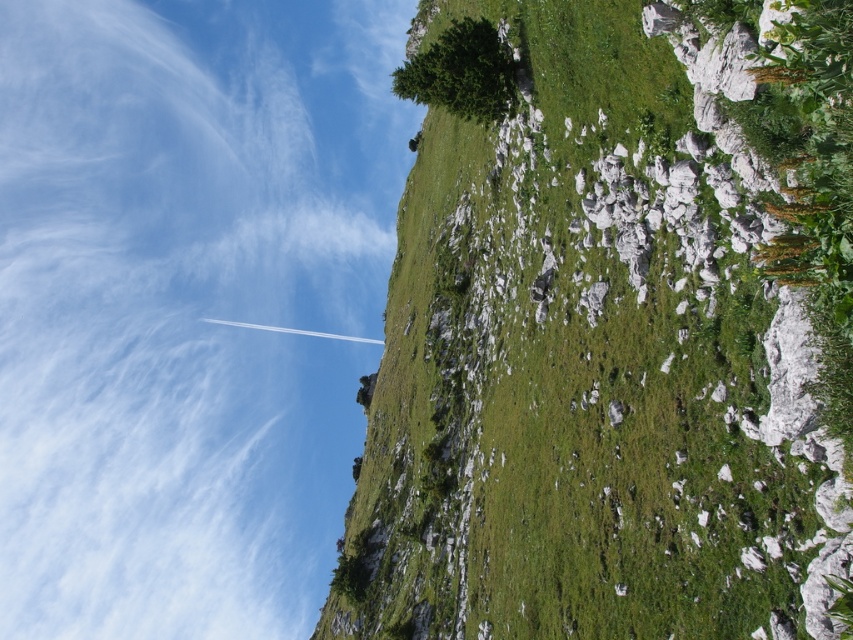
You are standing at the point marked as point (x=613, y=330) in the image. Looking around, you see the green grassy hillside at upper center. What is the immediate terrain you are standing on?

The immediate terrain at point (x=613, y=330) is the green grassy hillside at upper center.

You are standing in the middle of the green grassy field with scattered white rocks and want to walk towards the point at coordinates point (781, 230) and point (280, 448). Which point will you reach first?

You will reach point (781, 230) first because it is closer to you than point (280, 448).

You are standing on the green grassy hillside at upper center and looking towards the white fluffy cloud at upper left. Which one is closer to the ground?

The green grassy hillside at upper center is closer to the ground than the white fluffy cloud at upper left because it is shorter.